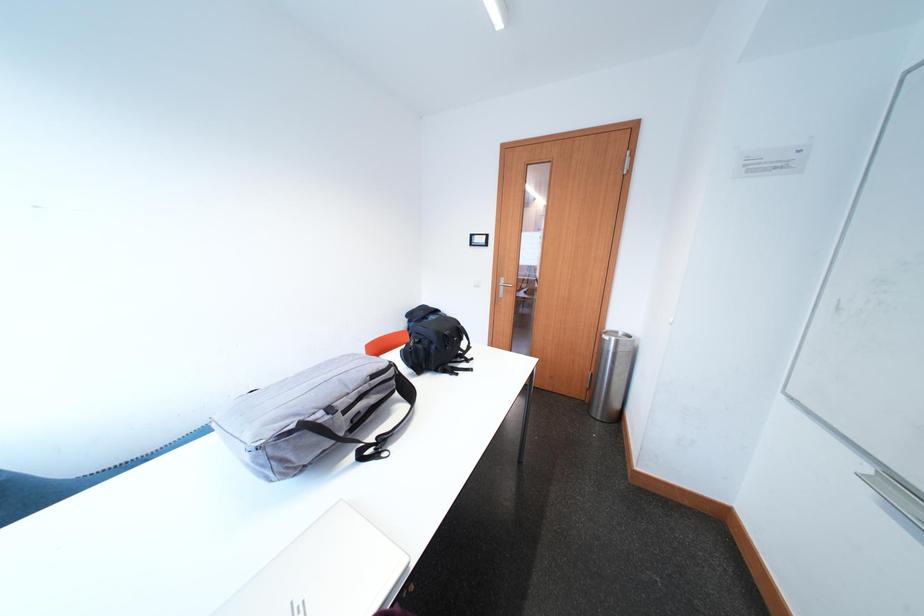
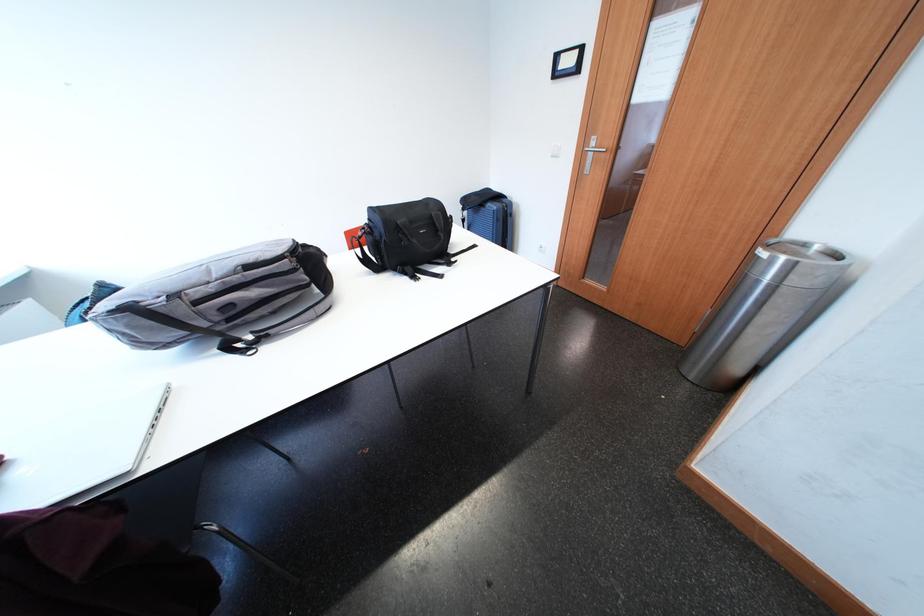
How did the camera likely rotate?

The camera's rotation is toward left-down.